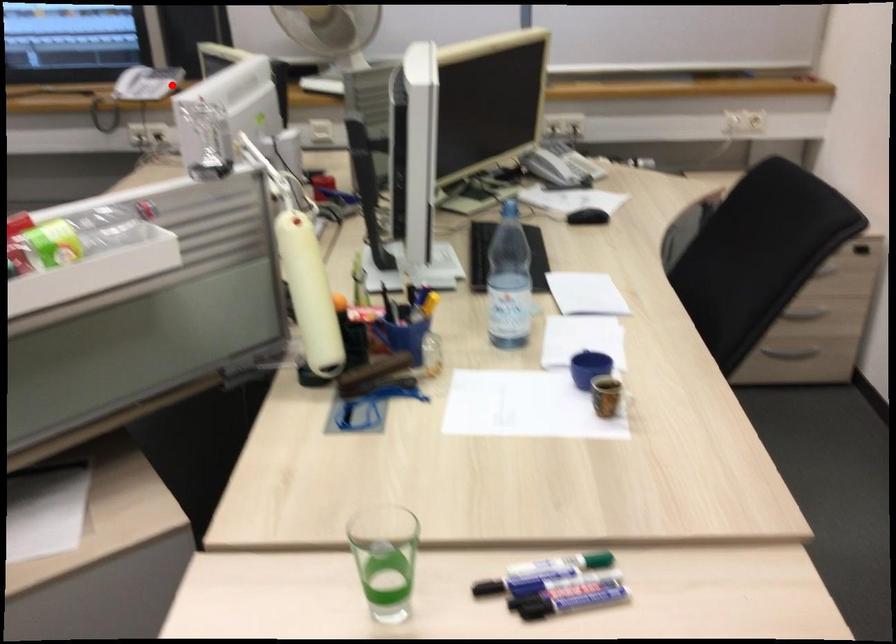
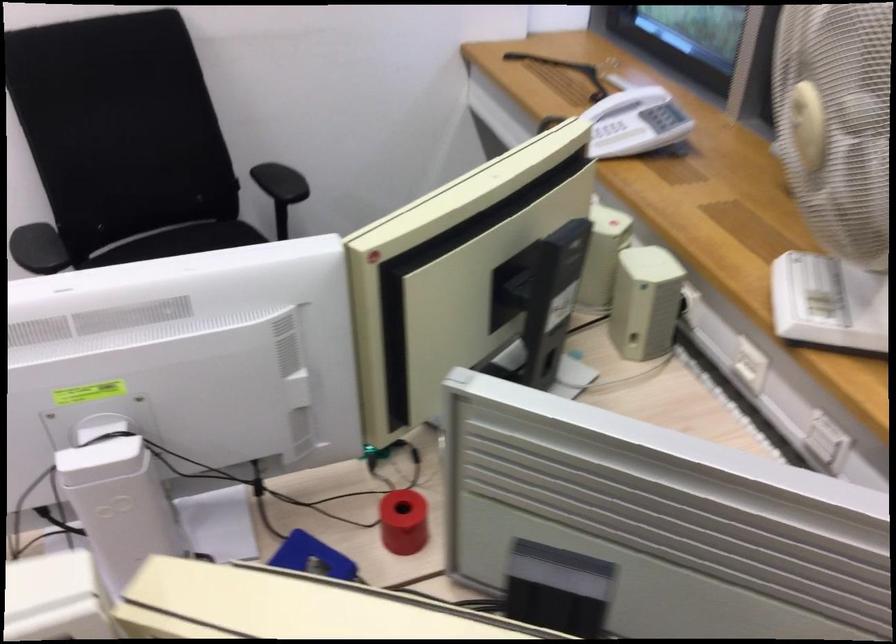
Question: A red point is marked in image1. In image2, is the corresponding 3D point closer to the camera or farther? Reply with the corresponding letter.

Choices:
 (A) The corresponding 3D point is closer.
 (B) The corresponding 3D point is farther.

Answer: (A)